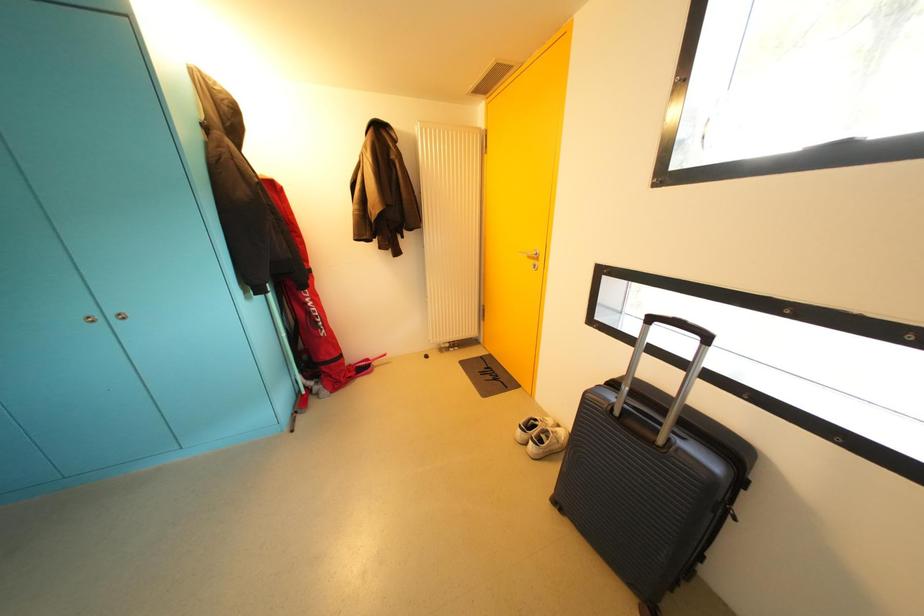
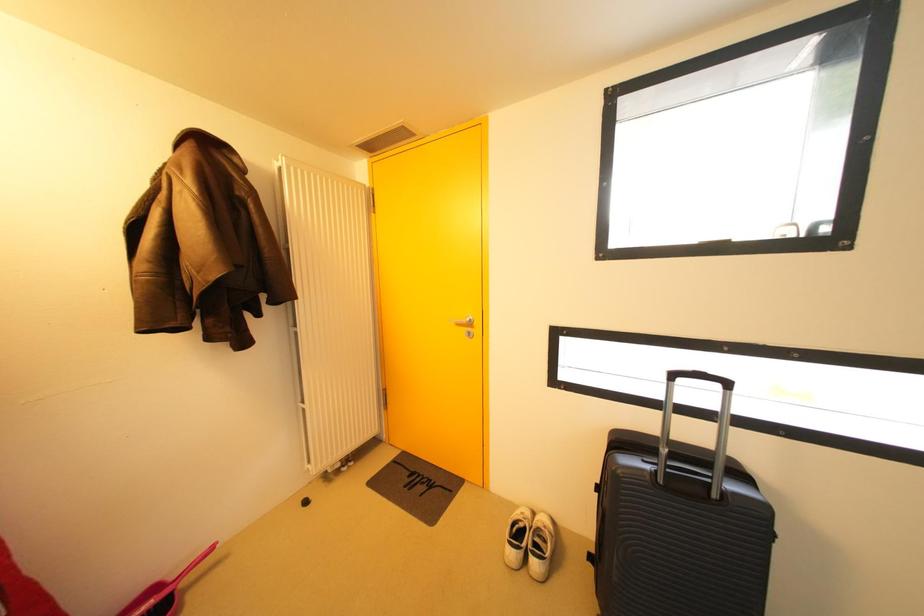
Question: The camera is either moving clockwise (left) or counter-clockwise (right) around the object. The first image is from the beginning of the video and the second image is from the end. Is the camera moving left or right when shooting the video?

Choices:
 (A) Left
 (B) Right

Answer: (A)